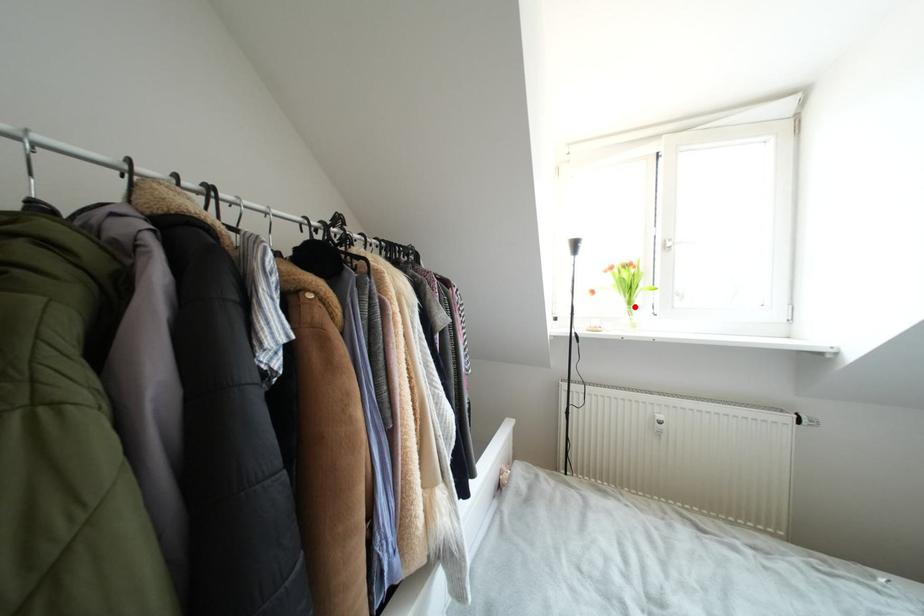
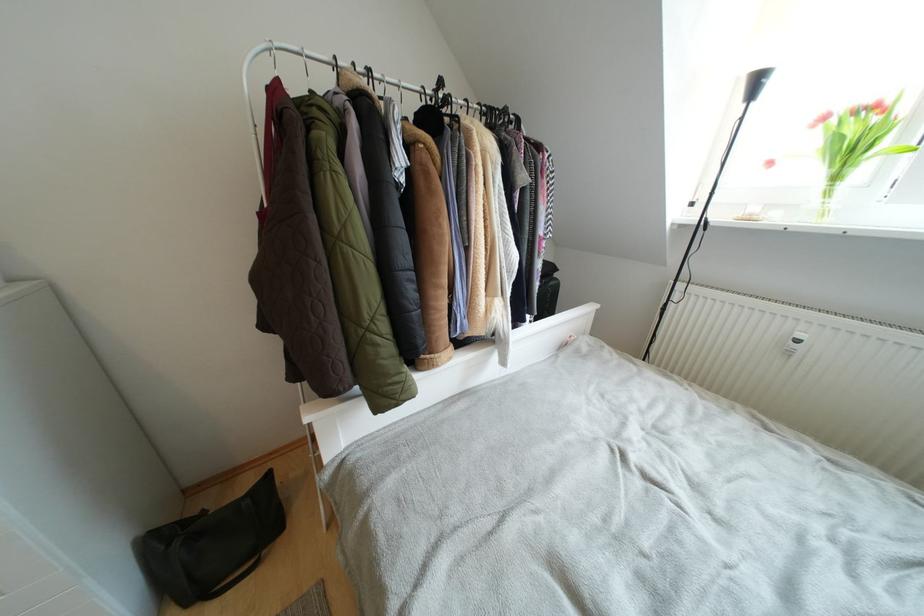
Question: I am providing you with two images of the same scene from different viewpoints. In image1, a red point is highlighted. Considering the same 3D point in image2, which of the following is correct?

Choices:
 (A) It is closer
 (B) It is farther

Answer: (B)